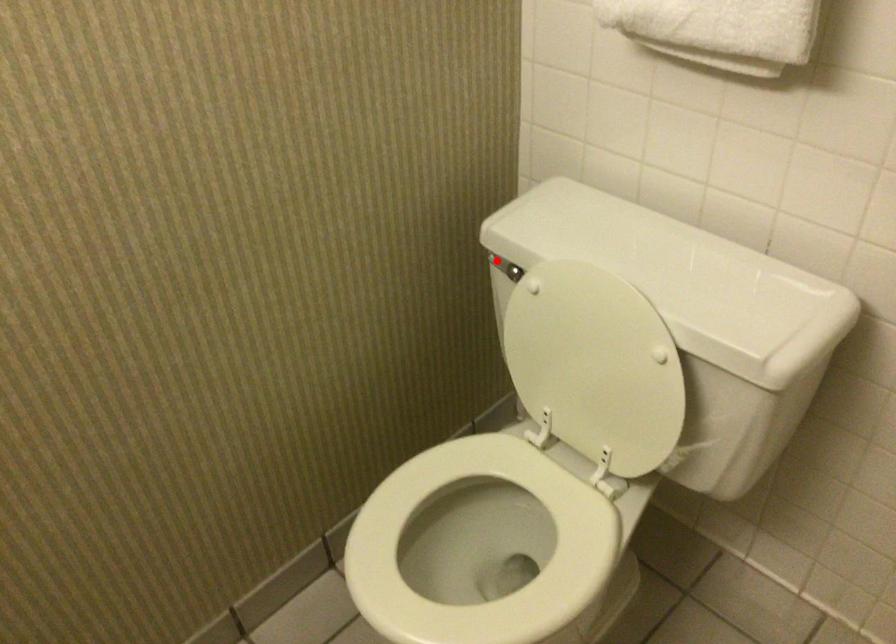
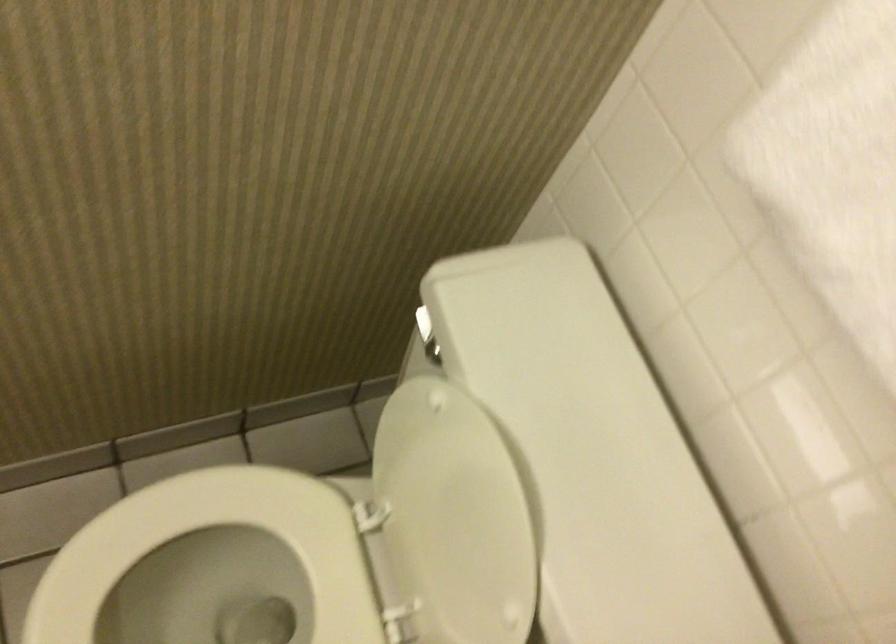
The point at the highlighted location is marked in the first image. Where is the corresponding point in the second image?

(423, 323)